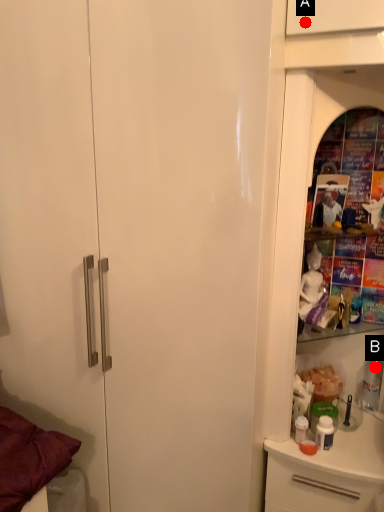
Question: Two points are circled on the image, labeled by A and B beside each circle. Which of the following is the closest to the observer?

Choices:
 (A) A is closer
 (B) B is closer

Answer: (A)